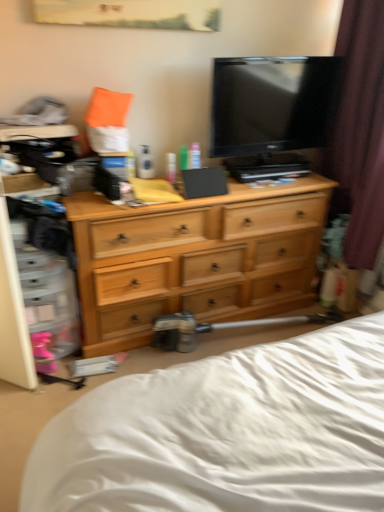
Question: Does point (364, 248) appear closer or farther from the camera than point (198, 166)?

Choices:
 (A) farther
 (B) closer

Answer: (A)

Question: From a real-world perspective, relative to translucent plastic tube at center, the second toiletry viewed from the left, is brown velvet curtain at right vertically above or below?

Choices:
 (A) below
 (B) above

Answer: (B)

Question: Estimate the real-world distances between objects in this image. Which object is farther from the brown velvet curtain at right?

Choices:
 (A) green plastic bottle at center, the first toiletry positioned from the left
 (B) translucent plastic tube at center, placed as the first toiletry when sorted from right to left
 (C) white soft bed at lower center
 (D) light wood dresser at center
 (E) black glossy tv at upper center

Answer: (C)

Question: Which of these objects is positioned closest to the brown velvet curtain at right?

Choices:
 (A) green plastic bottle at center, the 2th toiletry from the right
 (B) light wood dresser at center
 (C) black glossy tv at upper center
 (D) white soft bed at lower center
 (E) translucent plastic tube at center, the second toiletry viewed from the left

Answer: (C)